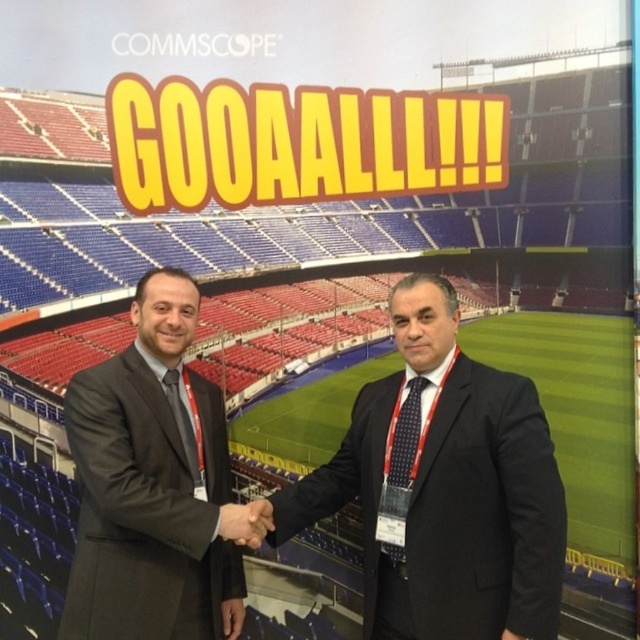
Question: Does dark suit at center appear under dark gray suit at center?

Choices:
 (A) yes
 (B) no

Answer: (A)

Question: Which of these objects is positioned closest to the dark suit at center?

Choices:
 (A) dark gray suit at center
 (B) smooth skin handshake at center

Answer: (B)

Question: Is dark suit at center closer to camera compared to smooth skin handshake at center?

Choices:
 (A) no
 (B) yes

Answer: (B)

Question: Estimate the real-world distances between objects in this image. Which object is farther from the dark gray suit at center?

Choices:
 (A) dark suit at center
 (B) smooth skin handshake at center

Answer: (A)

Question: Which is farther from the smooth skin handshake at center?

Choices:
 (A) dark gray suit at center
 (B) dark suit at center

Answer: (B)

Question: Is dark suit at center wider than dark gray suit at center?

Choices:
 (A) yes
 (B) no

Answer: (A)